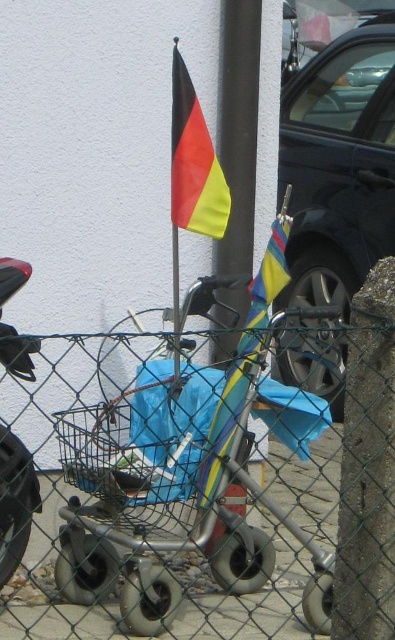
You are standing at the camera position and want to take a photo of the matte fabric flag at center. If you move forward 3 feet, will the flag appear larger in the photo?

Yes, moving forward 3 feet will reduce the distance to 4.01 feet, making the flag appear larger in the photo.